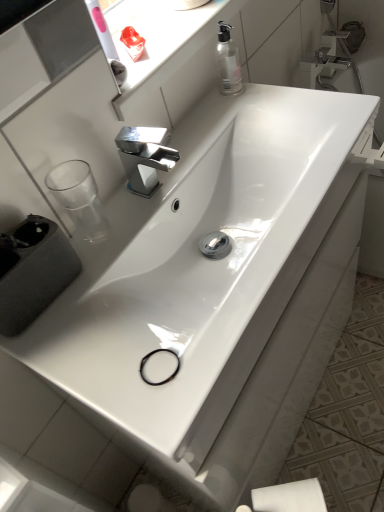
You are a GUI agent. You are given a task and a screenshot of the screen. Output one action in this format:
    pyautogui.click(x=<x>, y=<y>)
    Task: Click on the vacant area that lies to the right of polished chrome faucet at center
    The height and width of the screenshot is (512, 384).
    Given the screenshot: What is the action you would take?
    pyautogui.click(x=202, y=151)